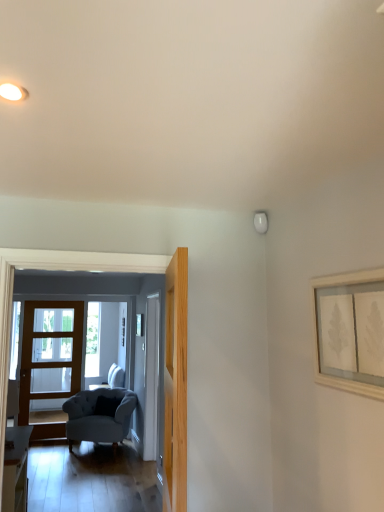
Question: Is light wood door at center, the first door viewed from the front, bigger or smaller than light gray fabric armchair at left?

Choices:
 (A) big
 (B) small

Answer: (B)

Question: Does point (185, 268) appear closer or farther from the camera than point (173, 418)?

Choices:
 (A) farther
 (B) closer

Answer: (B)

Question: Based on their relative distances, which object is farther from the wooden framed picture at upper right?

Choices:
 (A) light wood door at center, arranged as the 3th door when viewed from the back
 (B) light gray fabric armchair at left
 (C) wooden glass door at left, arranged as the 3th door when viewed from the right
 (D) suede-like gray armchair at lower left
 (E) white glossy door at center, the second door from the back

Answer: (C)

Question: Which of these objects is positioned closest to the light gray fabric armchair at left?

Choices:
 (A) wooden framed picture at upper right
 (B) wooden glass door at left, which ranks as the first door in back-to-front order
 (C) suede-like gray armchair at lower left
 (D) light wood door at center, acting as the first door starting from the right
 (E) white glossy door at center, the 2th door from the front

Answer: (D)